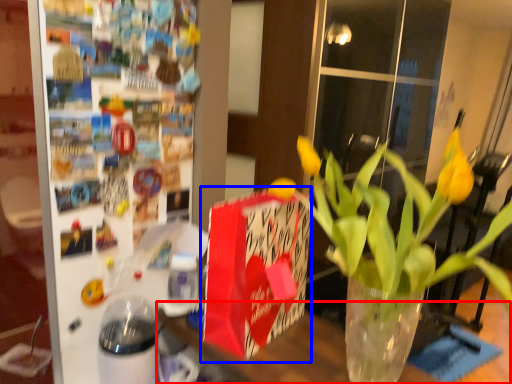
Question: Among these objects, which one is nearest to the camera, table (highlighted by a red box) or gift bag (highlighted by a blue box)?

Choices:
 (A) table
 (B) gift bag

Answer: (A)